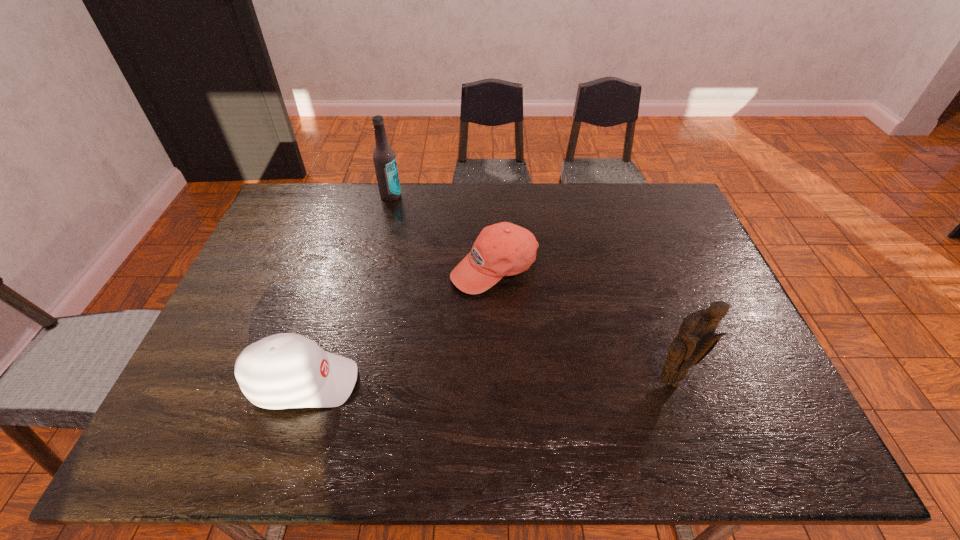
Find the location of a particular element. the left baseball cap is located at coordinates (286, 370).

What are the coordinates of `figurine` in the screenshot? It's located at (696, 339).

Image resolution: width=960 pixels, height=540 pixels. I want to click on the third nearest object, so pos(504,249).

Find the location of a particular element. the farther baseball cap is located at coordinates (504, 249).

Where is `the farthest object`? This screenshot has width=960, height=540. the farthest object is located at coordinates (384, 158).

What are the coordinates of `vacant area situated on the front-facing side of the left baseball cap` in the screenshot? It's located at (491, 382).

Find the location of a particular element. This screenshot has width=960, height=540. vacant space located on the front-facing side of the figurine is located at coordinates (680, 410).

This screenshot has height=540, width=960. I want to click on vacant region located on the front-facing side of the third nearest object, so click(x=500, y=366).

At what (x,y) coordinates should I click in order to perform the action: click on vacant region located on the front-facing side of the third nearest object. Please return your answer as a coordinate pair (x, y). The width and height of the screenshot is (960, 540). Looking at the image, I should click on 500,370.

Find the location of `vacant position located 0.290m on the front-facing side of the third nearest object`. vacant position located 0.290m on the front-facing side of the third nearest object is located at coordinates (501, 388).